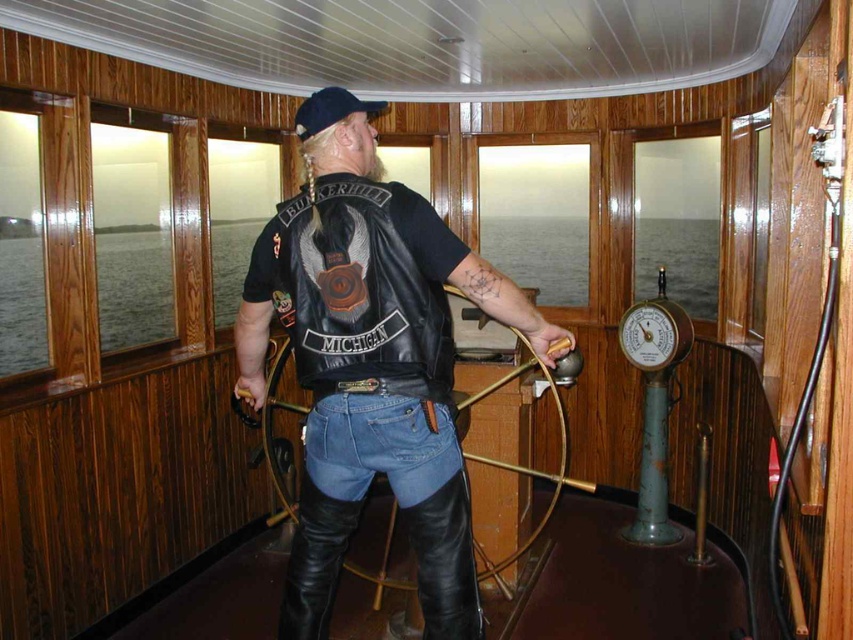
Who is higher up, leather jacket at center or denim jeans at center?

leather jacket at center is above.

Between point (289, 557) and point (376, 428), which one is positioned behind?

Positioned behind is point (289, 557).

I want to click on leather jacket at center, so click(x=370, y=362).